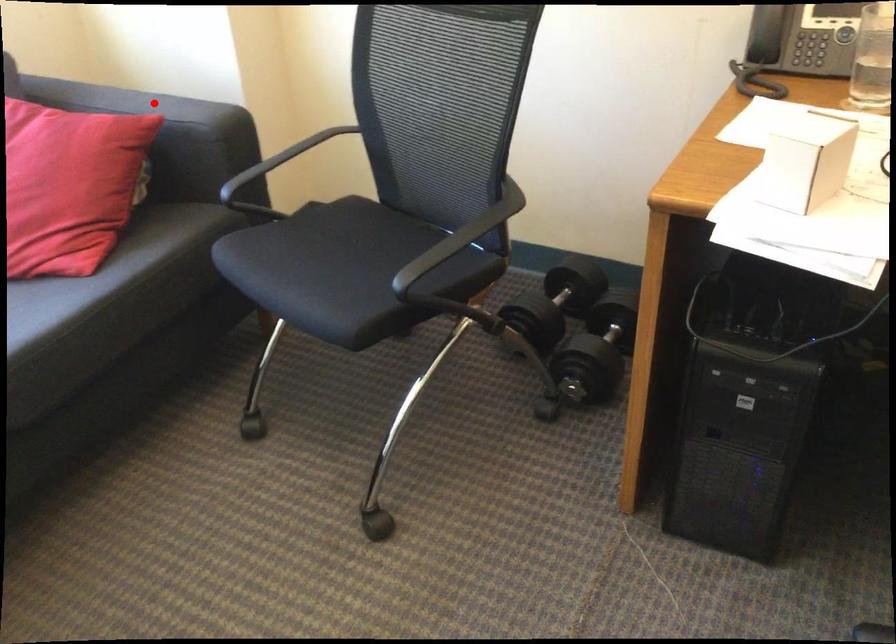
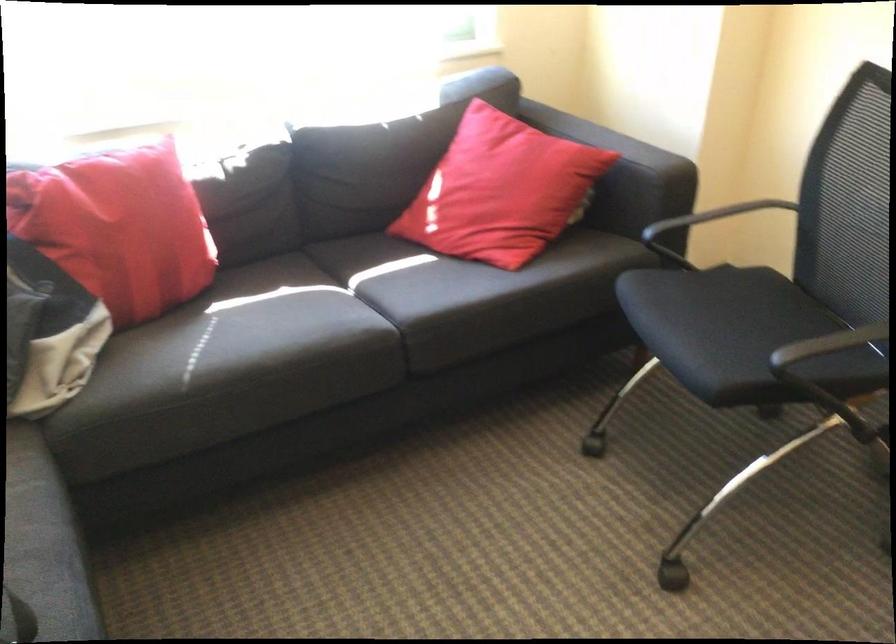
Question: I am providing you with two images of the same scene from different viewpoints. Given a red point in image1, look at the same physical point in image2. Is it:

Choices:
 (A) Closer to the viewpoint
 (B) Farther from the viewpoint

Answer: (B)